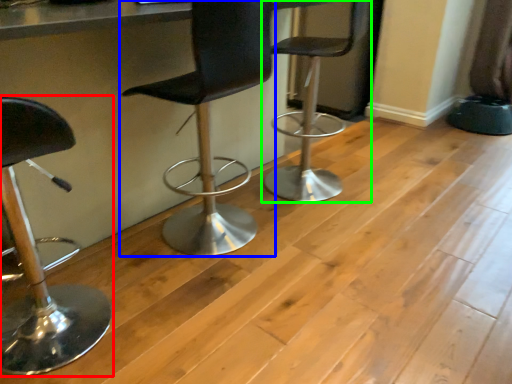
Question: Which object is the farthest from chair (highlighted by a red box)? Choose among these: chair (highlighted by a blue box) or chair (highlighted by a green box).

Choices:
 (A) chair
 (B) chair

Answer: (B)